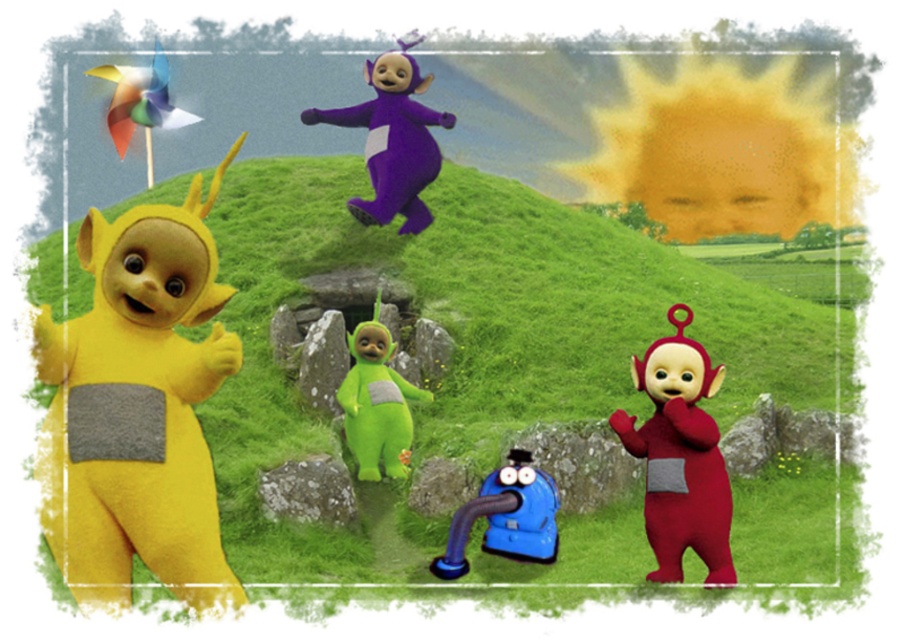
Consider the image. You are a child trying to reach both the green felt teletubby at center and the blue rubber toy at center. Which one can you grab first without moving your position?

The green felt teletubby at center is closer to you than the blue rubber toy at center, so you can grab it first without moving.

You are a child trying to decide which toy to pick up first. The matte red teletubby at right and the blue rubber toy at center are both in your view. Which one is narrower?

The matte red teletubby at right is thinner than the blue rubber toy at center, so it is narrower.

You are a parent trying to choose a toy for your child. You see the green felt teletubby at center and the blue rubber toy at center. Which one is bigger?

The green felt teletubby at center is larger in size compared to the blue rubber toy at center.